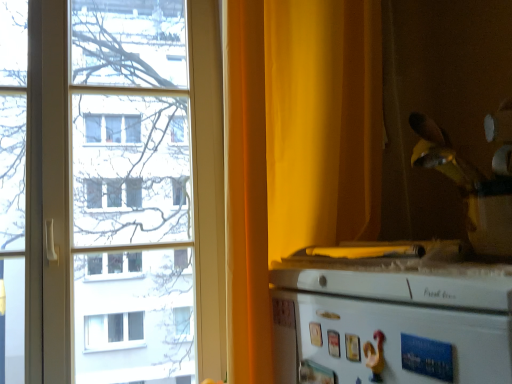
Question: From the image's perspective, relative to yellow fabric curtain at right, is white glossy refrigerator at lower right above or below?

Choices:
 (A) below
 (B) above

Answer: (A)

Question: Is white glossy refrigerator at lower right taller or shorter than yellow fabric curtain at right?

Choices:
 (A) tall
 (B) short

Answer: (B)

Question: Which object is the farthest from the yellow fabric curtain at right?

Choices:
 (A) white glossy refrigerator at lower right
 (B) transparent glass window at left

Answer: (B)

Question: Which object is positioned closest to the white glossy refrigerator at lower right?

Choices:
 (A) transparent glass window at left
 (B) yellow fabric curtain at right

Answer: (B)